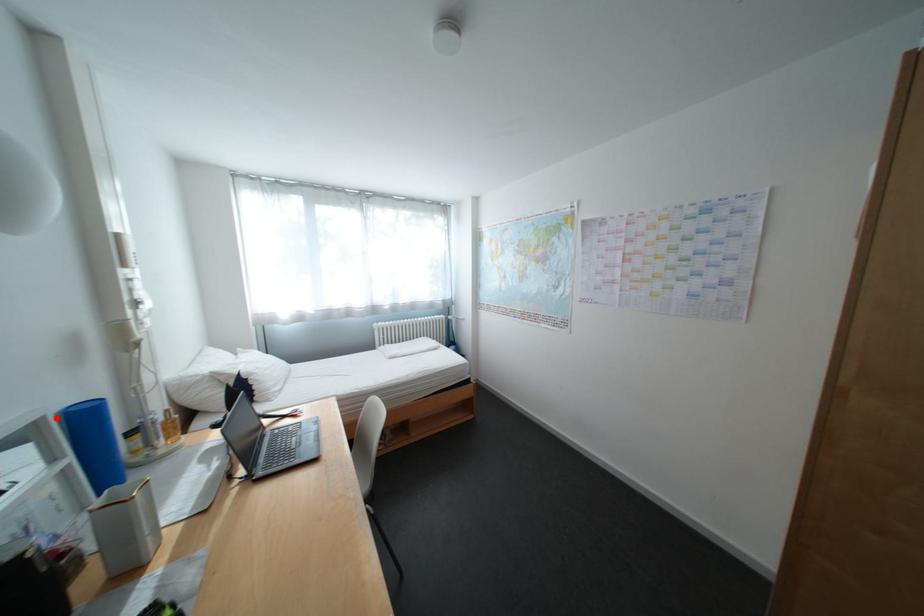
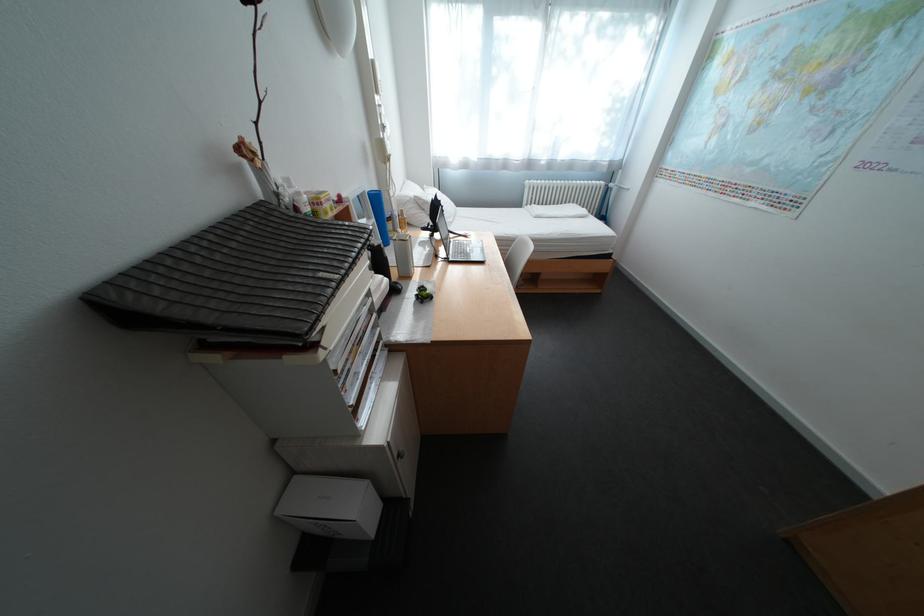
Find the pixel in the second image that matches the highlighted location in the first image.

(378, 192)